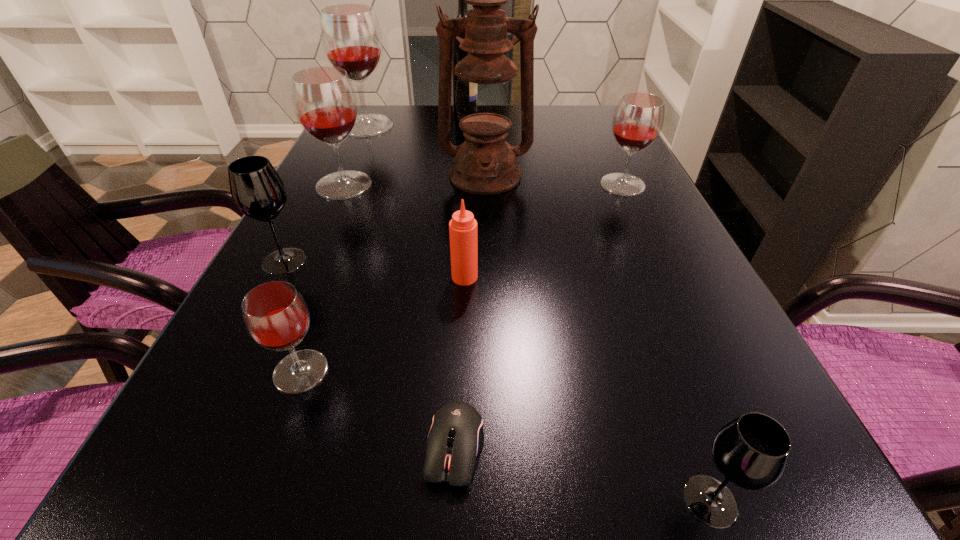
Find the location of a particular element. vacant space situated on the back of the fourth farthest wineglass is located at coordinates (307, 216).

Where is `vacant space located on the left of the third biggest red wineglass`? The image size is (960, 540). vacant space located on the left of the third biggest red wineglass is located at coordinates (514, 185).

Locate an element on the screen. free spot located on the left of the Tabasco sauce is located at coordinates (403, 277).

What are the coordinates of `free spot located 0.160m on the front of the smallest red wineglass` in the screenshot? It's located at (249, 514).

Identify the location of vacant space located on the left of the right gray wineglass. (608, 501).

This screenshot has height=540, width=960. What are the coordinates of `vacant space positioned 0.090m on the back of the shortest object` in the screenshot? It's located at (459, 357).

This screenshot has width=960, height=540. Identify the location of wine bottle that is at the far edge. (458, 54).

Find the location of a particular element. The image size is (960, 540). wineglass at the far edge is located at coordinates (350, 34).

Identify the location of wineglass located in the near edge section of the desktop. Image resolution: width=960 pixels, height=540 pixels. (752, 451).

Locate an element on the screen. computer mouse that is at the near edge is located at coordinates (455, 438).